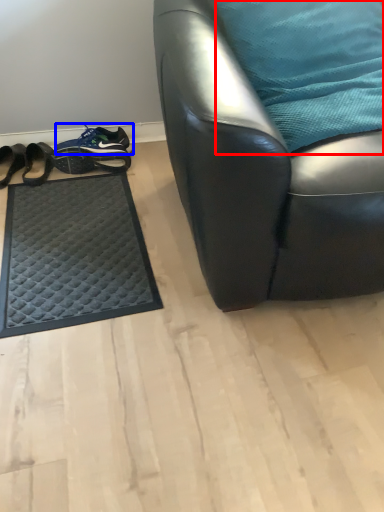
Question: Which of the following is the farthest to the observer, pillow (highlighted by a red box) or footwear (highlighted by a blue box)?

Choices:
 (A) pillow
 (B) footwear

Answer: (B)